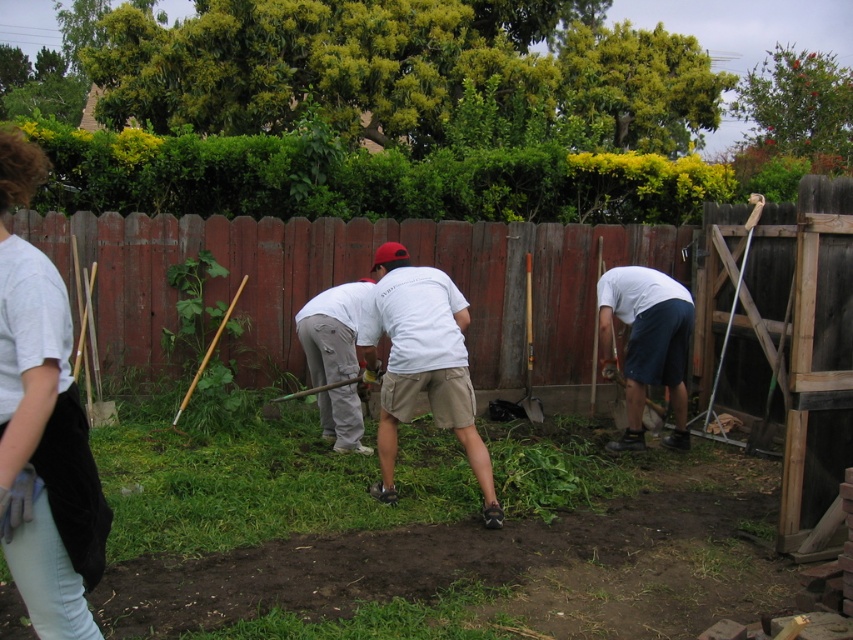
Question: Which object is closer to the camera taking this photo?

Choices:
 (A) white cotton shirt at center
 (B) light gray cotton pants at center
 (C) light blue jeans at lower left
 (D) white matte shorts at lower right

Answer: (C)

Question: Which of the following is the farthest from the observer?

Choices:
 (A) (322, 376)
 (B) (438, 401)

Answer: (A)

Question: Considering the relative positions of white cotton shirt at center and white matte shorts at lower right in the image provided, where is white cotton shirt at center located with respect to white matte shorts at lower right?

Choices:
 (A) right
 (B) left

Answer: (B)

Question: Is light blue jeans at lower left above light gray cotton pants at center?

Choices:
 (A) yes
 (B) no

Answer: (A)

Question: Which object is farther from the camera taking this photo?

Choices:
 (A) white cotton shirt at center
 (B) white matte shorts at lower right

Answer: (B)

Question: Can you confirm if light blue jeans at lower left is positioned below white cotton shirt at center?

Choices:
 (A) yes
 (B) no

Answer: (B)